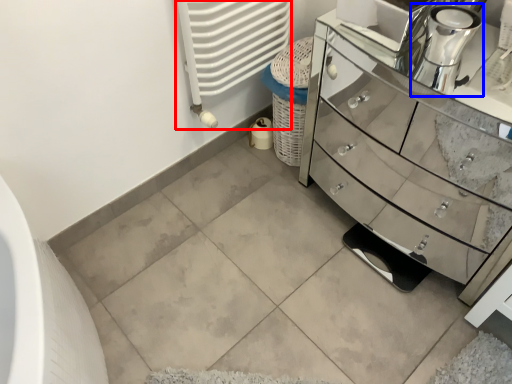
Question: Among these objects, which one is farthest to the camera, radiator (highlighted by a red box) or coffee machine (highlighted by a blue box)?

Choices:
 (A) radiator
 (B) coffee machine

Answer: (A)